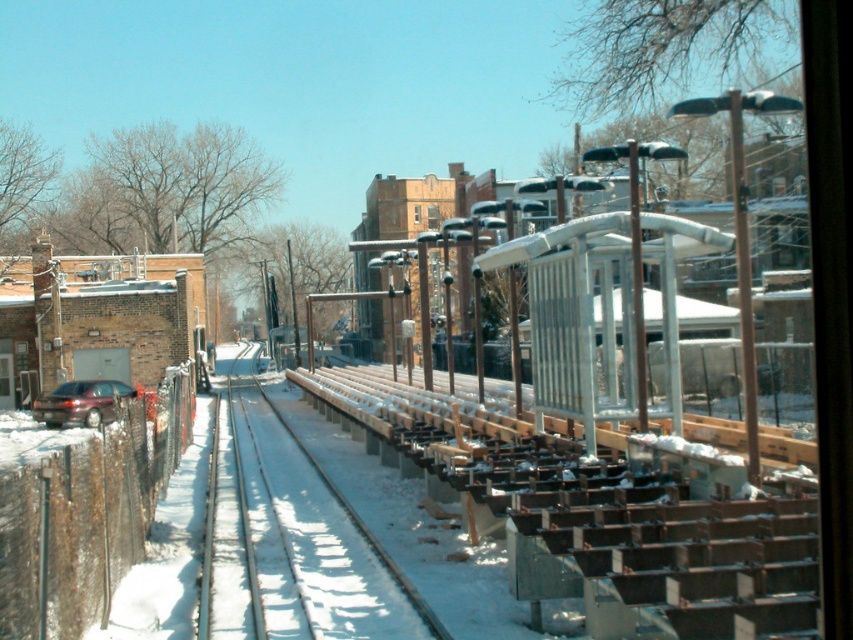
Who is taller, wooden bench at center or matte dark brown car at left?

matte dark brown car at left is taller.

Does wooden bench at center have a greater width compared to matte dark brown car at left?

Yes, wooden bench at center is wider than matte dark brown car at left.

What do you see at coordinates (292, 536) in the screenshot? Image resolution: width=853 pixels, height=640 pixels. I see `wooden bench at center` at bounding box center [292, 536].

Where is `wooden bench at center`? The image size is (853, 640). wooden bench at center is located at coordinates (292, 536).